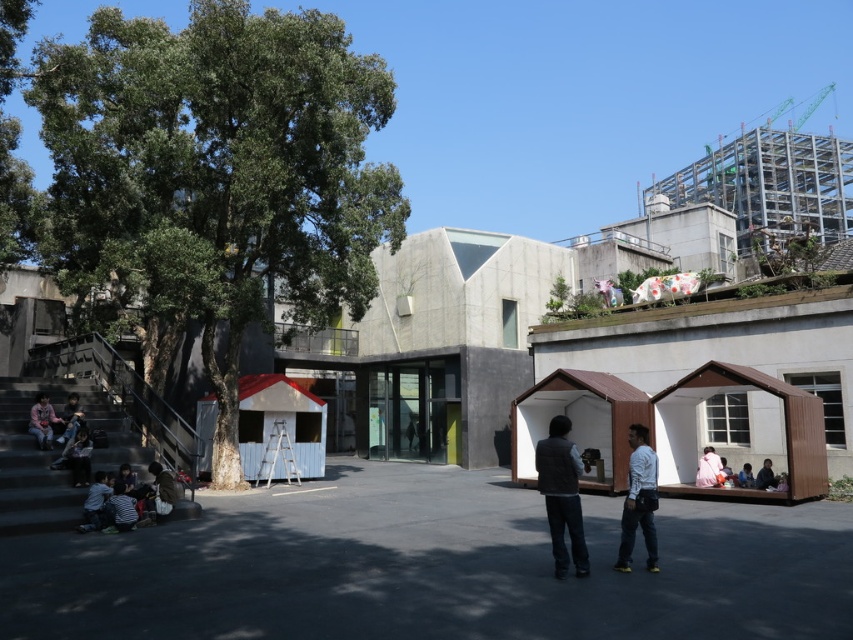
Question: Can you confirm if light brown leather jacket at lower left is positioned below dark brown leather jacket at lower right?

Choices:
 (A) yes
 (B) no

Answer: (B)

Question: Which point appears farthest from the camera in this image?

Choices:
 (A) (169, 477)
 (B) (569, 458)
 (C) (480, 296)
 (D) (749, 484)

Answer: (C)

Question: Estimate the real-world distances between objects in this image. Which object is closer to the light blue shirt at lower right?

Choices:
 (A) white matte shirt at center
 (B) brown leather jacket at lower left
 (C) striped fabric shirt at lower left

Answer: (A)

Question: Observing the image, what is the correct spatial positioning of wooden cabin at center in reference to dark brown leather jacket at lower right?

Choices:
 (A) above
 (B) below

Answer: (B)

Question: Which point is closer to the camera?

Choices:
 (A) (773, 483)
 (B) (747, 474)
 (C) (33, 403)
 (D) (169, 474)

Answer: (D)

Question: Is matte gray hut at center below light brown leather jacket at lower left?

Choices:
 (A) yes
 (B) no

Answer: (B)